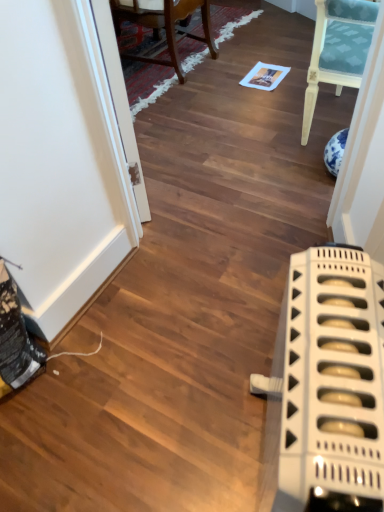
Question: Is white plastic radiator at lower right positioned with its back to transparent glass door at upper left?

Choices:
 (A) no
 (B) yes

Answer: (A)

Question: From a real-world perspective, is white plastic radiator at lower right located higher than transparent glass door at upper left?

Choices:
 (A) yes
 (B) no

Answer: (B)

Question: Is white plastic radiator at lower right further to camera compared to transparent glass door at upper left?

Choices:
 (A) yes
 (B) no

Answer: (B)

Question: Are white plastic radiator at lower right and transparent glass door at upper left far apart?

Choices:
 (A) yes
 (B) no

Answer: (B)

Question: Does white plastic radiator at lower right have a greater width compared to transparent glass door at upper left?

Choices:
 (A) yes
 (B) no

Answer: (A)

Question: In terms of width, does transparent glass door at upper left look wider or thinner when compared to white plastic radiator at lower right?

Choices:
 (A) thin
 (B) wide

Answer: (A)

Question: Based on their sizes in the image, would you say transparent glass door at upper left is bigger or smaller than white plastic radiator at lower right?

Choices:
 (A) small
 (B) big

Answer: (A)

Question: From their relative heights in the image, would you say transparent glass door at upper left is taller or shorter than white plastic radiator at lower right?

Choices:
 (A) tall
 (B) short

Answer: (A)

Question: From the image's perspective, is transparent glass door at upper left above or below white plastic radiator at lower right?

Choices:
 (A) below
 (B) above

Answer: (B)

Question: Is wooden chair at upper center wider or thinner than transparent glass door at upper left?

Choices:
 (A) wide
 (B) thin

Answer: (A)

Question: Based on their sizes in the image, would you say wooden chair at upper center is bigger or smaller than transparent glass door at upper left?

Choices:
 (A) big
 (B) small

Answer: (A)

Question: Does point (170, 3) appear closer or farther from the camera than point (92, 16)?

Choices:
 (A) closer
 (B) farther

Answer: (B)

Question: Relative to transparent glass door at upper left, is wooden chair at upper center in front or behind?

Choices:
 (A) behind
 (B) front

Answer: (A)

Question: In terms of width, does wooden chair at upper center look wider or thinner when compared to white plastic radiator at lower right?

Choices:
 (A) wide
 (B) thin

Answer: (A)

Question: Based on their sizes in the image, would you say wooden chair at upper center is bigger or smaller than white plastic radiator at lower right?

Choices:
 (A) big
 (B) small

Answer: (A)